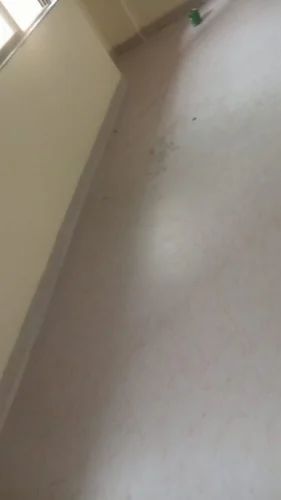
Identify the location of light. (28, 11).